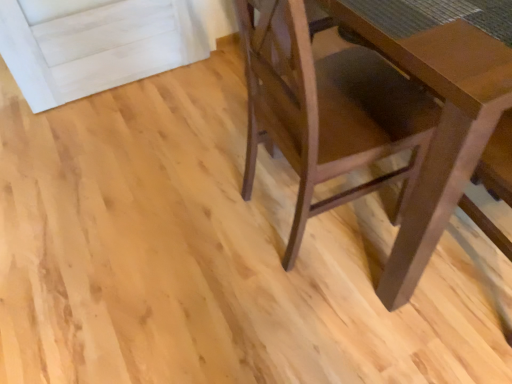
This screenshot has height=384, width=512. I want to click on matte brown chair at center, so (374, 119).

What do you see at coordinates (374, 119) in the screenshot? This screenshot has width=512, height=384. I see `matte brown chair at center` at bounding box center [374, 119].

Image resolution: width=512 pixels, height=384 pixels. I want to click on matte brown chair at center, so click(x=374, y=119).